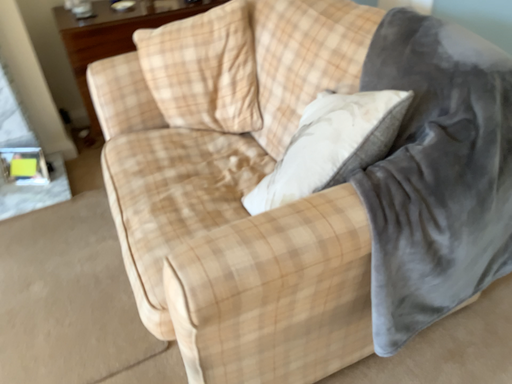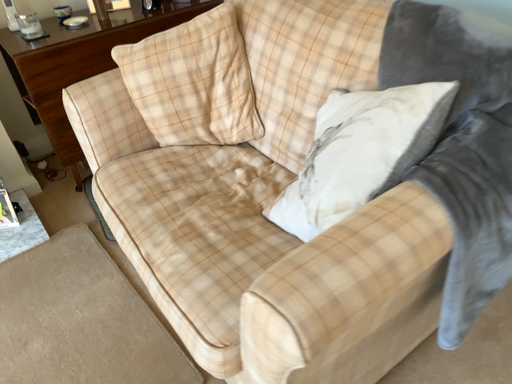
Question: How did the camera likely rotate when shooting the video?

Choices:
 (A) rotated left
 (B) rotated right

Answer: (B)